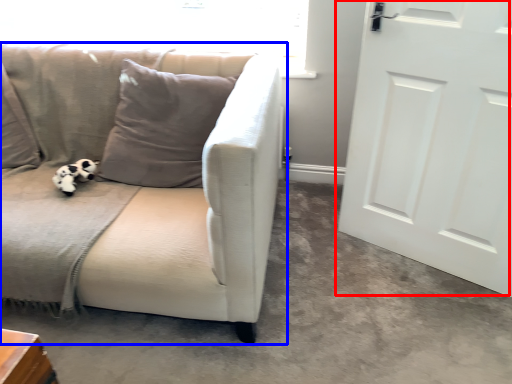
Question: Which of the following is the farthest to the observer, door (highlighted by a red box) or studio couch (highlighted by a blue box)?

Choices:
 (A) door
 (B) studio couch

Answer: (A)